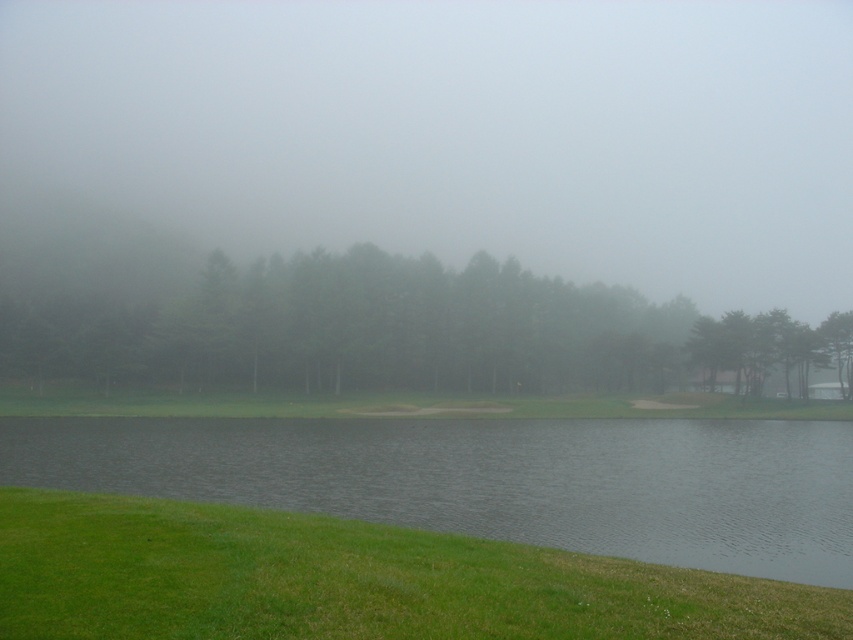
You are an artist sketching this scene. You need to decide which object, the gray water at lower center or the green matte tree at upper right, should be drawn first based on their vertical positions. Which one should you start with?

The green matte tree at upper right is taller than the gray water at lower center, so you should start by drawing the green matte tree at upper right first to establish the vertical hierarchy of the scene.